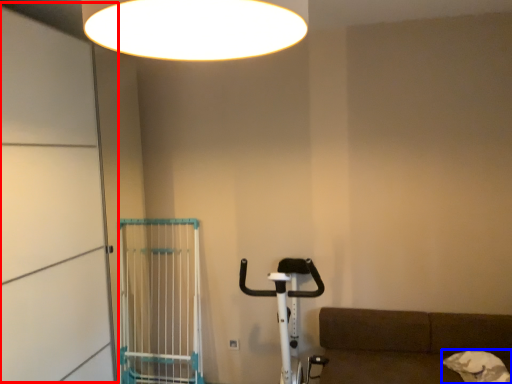
Question: Which of the following is the farthest to the observer, screen door (highlighted by a red box) or dog (highlighted by a blue box)?

Choices:
 (A) screen door
 (B) dog

Answer: (B)